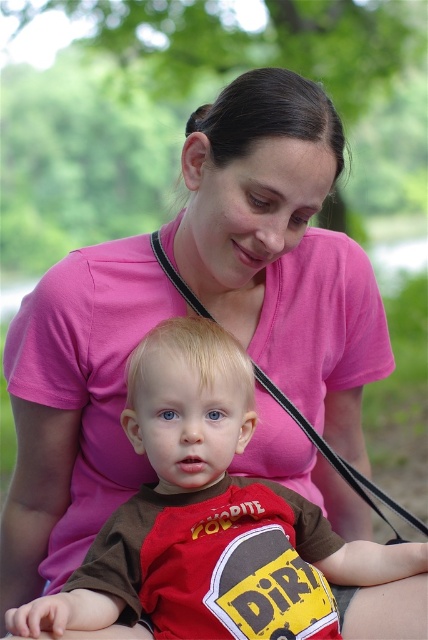
Based on the scene description, where is the brown cotton shirt at center located in terms of coordinates?

The brown cotton shirt at center is located at coordinates point (195, 509).

You are a photographer setting up for a family portrait. You need to ensure that the brown cotton shirt at center and the black leather strap at center are both visible in the final shot. Based on their positions, which object should you focus on first to ensure both are in frame?

The brown cotton shirt at center is below the black leather strap at center, so you should focus on the black leather strap at center first to ensure both are visible in the frame.